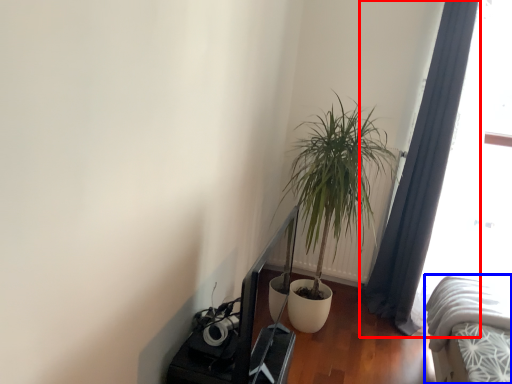
Question: Among these objects, which one is farthest to the camera, curtain (highlighted by a red box) or bed (highlighted by a blue box)?

Choices:
 (A) curtain
 (B) bed

Answer: (A)